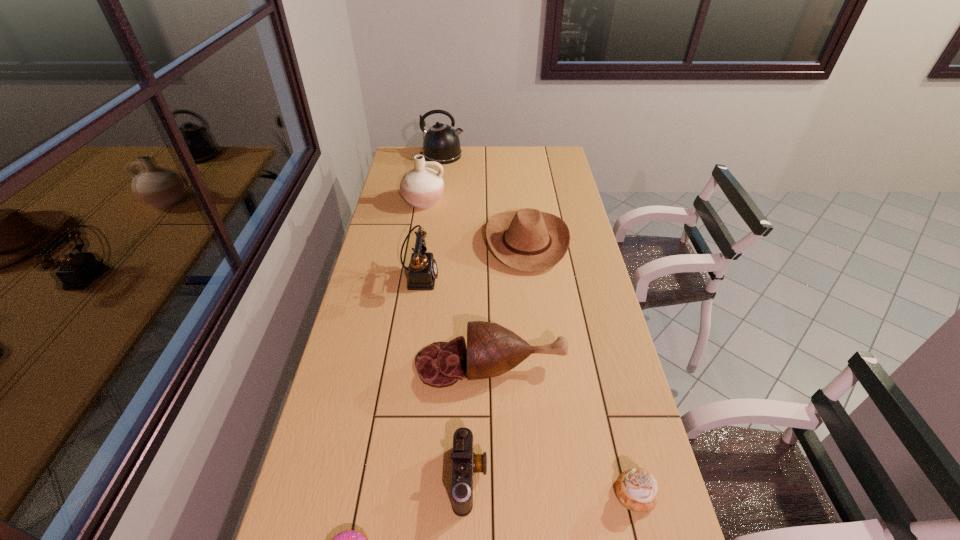
I want to click on free space between the second farthest object and the camera, so click(446, 339).

This screenshot has width=960, height=540. I want to click on object that ranks as the fourth closest to the pottery, so click(x=492, y=350).

You are a GUI agent. You are given a task and a screenshot of the screen. Output one action in this format:
    pyautogui.click(x=<x>, y=<y>)
    Task: Click on the fifth closest object to the ham
    
    Given the screenshot: What is the action you would take?
    pyautogui.click(x=349, y=539)

You are a GUI agent. You are given a task and a screenshot of the screen. Output one action in this format:
    pyautogui.click(x=<x>, y=<y>)
    Task: Click on the free space that satisfies the following two spatial constraints: 1. to pour from the handle of the pastry; 2. on the left side of the pottery
    The height and width of the screenshot is (540, 960).
    Given the screenshot: What is the action you would take?
    pyautogui.click(x=374, y=492)

Locate an element on the screen. vacant region that satisfies the following two spatial constraints: 1. to pour from the handle of the pastry; 2. on the left side of the seventh nearest object is located at coordinates (374, 492).

The image size is (960, 540). Find the location of `vacant region that satisfies the following two spatial constraints: 1. on the front of the pastry at the rotary dial; 2. on the right side of the telephone`. vacant region that satisfies the following two spatial constraints: 1. on the front of the pastry at the rotary dial; 2. on the right side of the telephone is located at coordinates (388, 492).

The width and height of the screenshot is (960, 540). I want to click on vacant point that satisfies the following two spatial constraints: 1. on the front-facing side of the cowboy hat; 2. on the left side of the pastry, so 558,492.